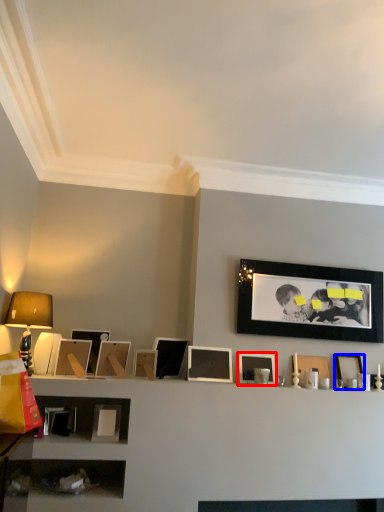
Question: Which object is closer to the camera taking this photo, picture frame (highlighted by a red box) or picture frame (highlighted by a blue box)?

Choices:
 (A) picture frame
 (B) picture frame

Answer: (A)